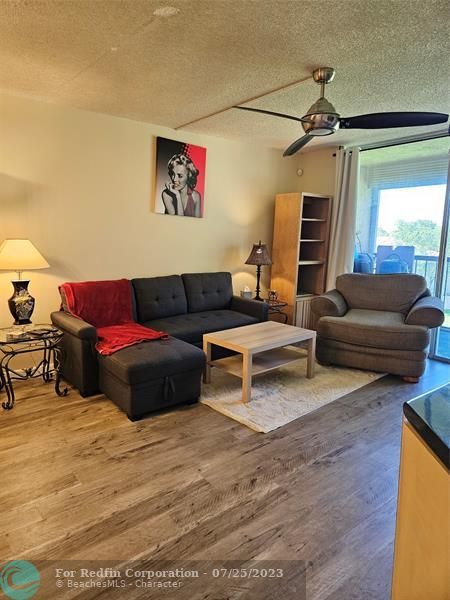
This screenshot has width=450, height=600. I want to click on cushion, so click(x=364, y=330), click(x=184, y=327), click(x=221, y=317), click(x=144, y=370).